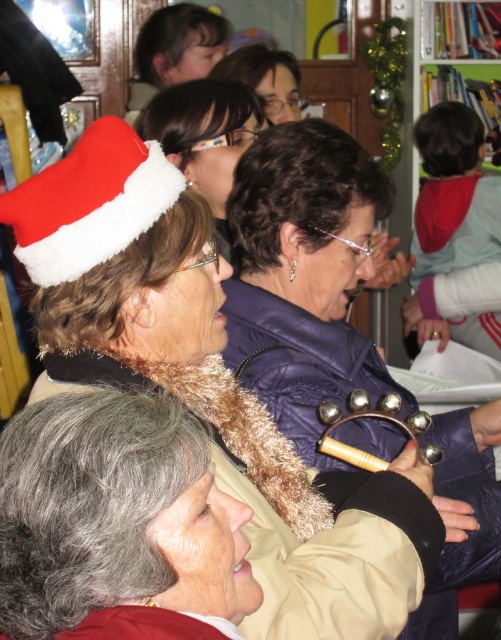
Is matte black santa hat at upper center above matte purple jacket at center?

No, matte black santa hat at upper center is not above matte purple jacket at center.

Can you confirm if matte black santa hat at upper center is shorter than matte purple jacket at center?

In fact, matte black santa hat at upper center may be taller than matte purple jacket at center.

Between point (200, 80) and point (269, 92), which one is positioned behind?

The point (269, 92) is behind.

Find the location of a particular element. The image size is (501, 640). matte black santa hat at upper center is located at coordinates (204, 136).

What do you see at coordinates (90, 202) in the screenshot? I see `red velvet santa hat at upper left` at bounding box center [90, 202].

Is point (128, 173) more distant than point (211, 97)?

No, (128, 173) is closer to viewer.

Between point (180, 182) and point (241, 84), which one is positioned in front?

Point (180, 182) is more forward.

Identify the location of red velvet santa hat at upper left. (90, 202).

In the scene shown: Is red velvet santa hat at upper left in front of matte purple jacket at center?

That is True.

Who is taller, red velvet santa hat at upper left or matte purple jacket at center?

matte purple jacket at center is taller.

Is point (73, 236) in front of point (214, 72)?

Yes, point (73, 236) is in front of point (214, 72).

You are a GUI agent. You are given a task and a screenshot of the screen. Output one action in this format:
    pyautogui.click(x=<x>, y=<y>)
    Task: Click on the red velvet santa hat at upper left
    The width and height of the screenshot is (501, 640).
    Given the screenshot: What is the action you would take?
    pyautogui.click(x=90, y=202)